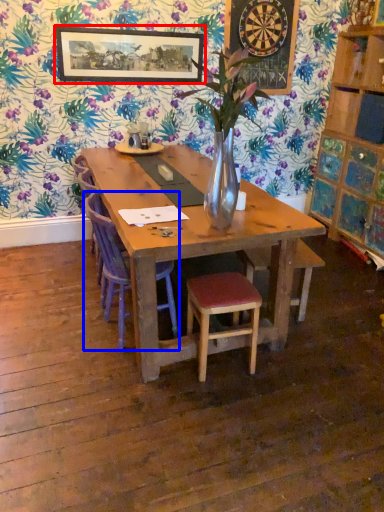
Question: Which of the following is the farthest to the observer, picture frame (highlighted by a red box) or chair (highlighted by a blue box)?

Choices:
 (A) picture frame
 (B) chair

Answer: (A)